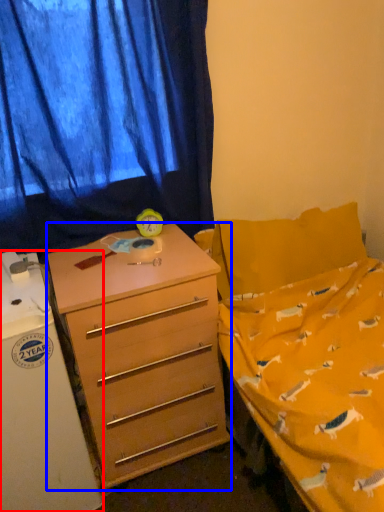
Question: Which object appears closest to the camera in this image, refrigerator (highlighted by a red box) or desk (highlighted by a blue box)?

Choices:
 (A) refrigerator
 (B) desk

Answer: (A)